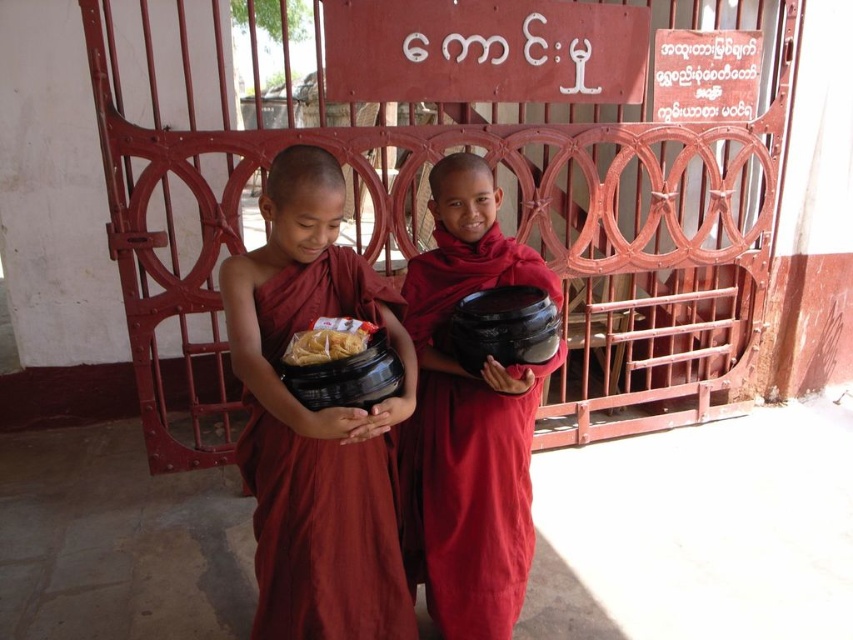
Can you confirm if matte red robe at center is positioned above matte black bowl at center?

No.

Is matte red robe at center closer to the viewer compared to matte black bowl at center?

Yes, matte red robe at center is in front of matte black bowl at center.

This screenshot has height=640, width=853. In order to click on matte red robe at center in this screenshot , I will do tap(316, 420).

The height and width of the screenshot is (640, 853). Identify the location of matte red robe at center. [x=316, y=420].

Does matte black bowl at center have a greater width compared to yellowish matte noodles at center?

Yes, matte black bowl at center is wider than yellowish matte noodles at center.

What do you see at coordinates (468, 419) in the screenshot? This screenshot has width=853, height=640. I see `matte black bowl at center` at bounding box center [468, 419].

Locate an element on the screen. matte black bowl at center is located at coordinates (468, 419).

What are the coordinates of `matte black bowl at center` in the screenshot? It's located at (468, 419).

Is matte red robe at center closer to the viewer compared to yellowish matte noodles at center?

That is True.

Does matte red robe at center appear on the left side of yellowish matte noodles at center?

Yes, matte red robe at center is to the left of yellowish matte noodles at center.

Does point (270, 582) come behind point (305, 332)?

Yes, it is behind point (305, 332).

I want to click on matte red robe at center, so click(x=316, y=420).